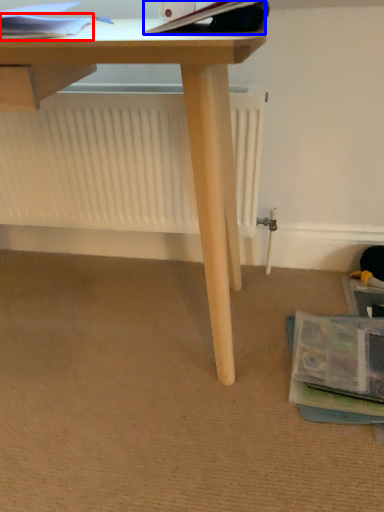
Question: Which object appears closest to the camera in this image, paperback book (highlighted by a red box) or paperback book (highlighted by a blue box)?

Choices:
 (A) paperback book
 (B) paperback book

Answer: (B)